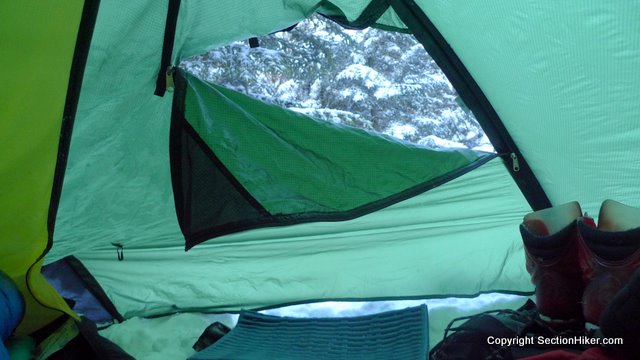
The image size is (640, 360). I want to click on blue mat, so click(x=249, y=322), click(x=420, y=310), click(x=415, y=352), click(x=319, y=341), click(x=208, y=354).